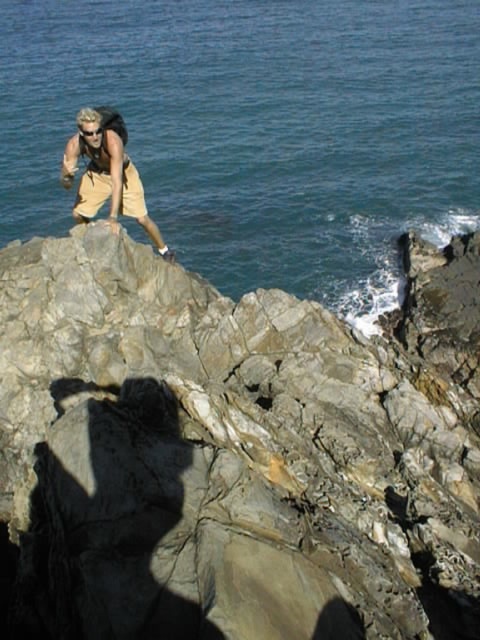
Question: Does blue water at upper center have a smaller size compared to tan cotton shorts at upper left?

Choices:
 (A) yes
 (B) no

Answer: (B)

Question: Is gray rocky cliff at upper left bigger than blue water at upper center?

Choices:
 (A) yes
 (B) no

Answer: (B)

Question: Considering the real-world distances, which object is closest to the gray rocky cliff at upper left?

Choices:
 (A) tan cotton shorts at upper left
 (B) blue water at upper center

Answer: (A)

Question: Which object is the farthest from the gray rocky cliff at upper left?

Choices:
 (A) tan cotton shorts at upper left
 (B) blue water at upper center

Answer: (B)

Question: Which point is closer to the camera taking this photo?

Choices:
 (A) (418, 362)
 (B) (93, 144)

Answer: (B)

Question: Can you confirm if gray rocky cliff at upper left is bigger than tan cotton shorts at upper left?

Choices:
 (A) yes
 (B) no

Answer: (B)